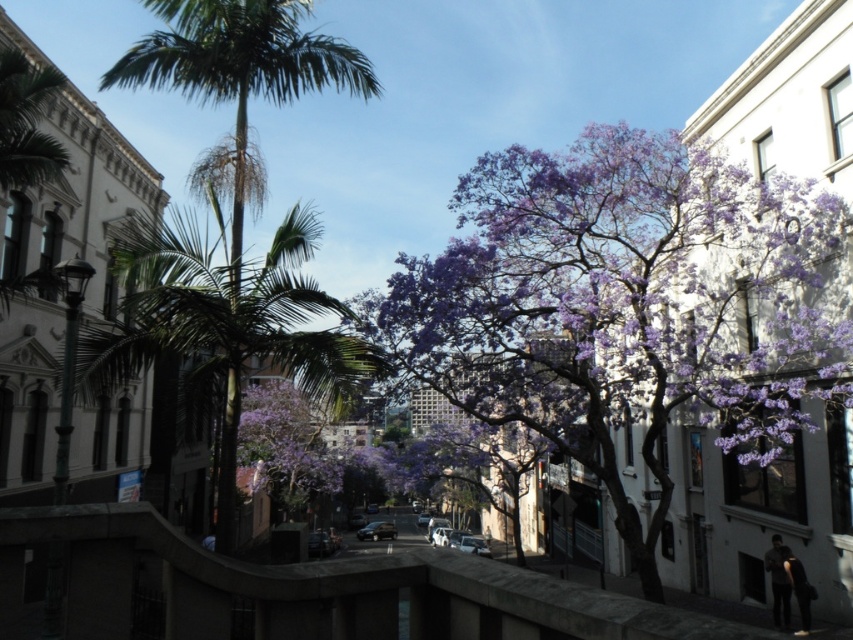
Does purple bloom at center have a larger size compared to green leafy palm tree at left?

No.

Between purple bloom at center and green leafy palm tree at left, which one is positioned higher?

green leafy palm tree at left is higher up.

At what (x,y) coordinates should I click in order to perform the action: click on purple bloom at center. Please return your answer as a coordinate pair (x, y). This screenshot has height=640, width=853. Looking at the image, I should click on (627, 298).

Where is `purple bloom at center`? The height and width of the screenshot is (640, 853). purple bloom at center is located at coordinates (627, 298).